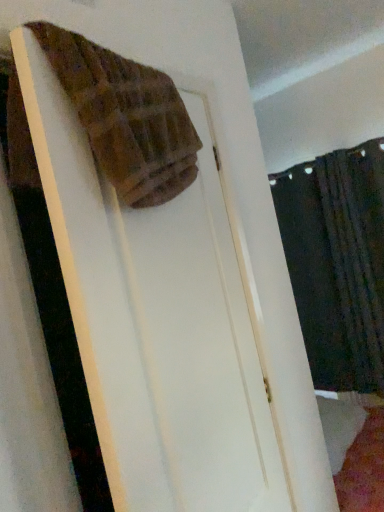
The height and width of the screenshot is (512, 384). Describe the element at coordinates (125, 117) in the screenshot. I see `brown woven towel at upper left` at that location.

Locate an element on the screen. Image resolution: width=384 pixels, height=512 pixels. brown woven towel at upper left is located at coordinates (125, 117).

The image size is (384, 512). What do you see at coordinates (337, 262) in the screenshot?
I see `dark fabric curtain at right` at bounding box center [337, 262].

I want to click on dark fabric curtain at right, so click(x=337, y=262).

You are a GUI agent. You are given a task and a screenshot of the screen. Output one action in this format:
    pyautogui.click(x=<x>, y=<y>)
    Task: Click on the brown woven towel at upper left
    The width and height of the screenshot is (384, 512).
    Given the screenshot: What is the action you would take?
    pyautogui.click(x=125, y=117)

Does dark fabric curtain at right appear on the left side of brown woven towel at upper left?

No.

Which object is further away from the camera taking this photo, dark fabric curtain at right or brown woven towel at upper left?

dark fabric curtain at right is behind.

Considering the points (381, 292) and (72, 59), which point is behind, point (381, 292) or point (72, 59)?

The point (381, 292) is farther from the camera.

From the image's perspective, is dark fabric curtain at right under brown woven towel at upper left?

Yes.

From a real-world perspective, is dark fabric curtain at right located higher than brown woven towel at upper left?

No, from a real-world perspective, dark fabric curtain at right is not over brown woven towel at upper left

Looking at their sizes, would you say dark fabric curtain at right is wider or thinner than brown woven towel at upper left?

dark fabric curtain at right is thinner than brown woven towel at upper left.

In the scene shown: Considering the sizes of objects dark fabric curtain at right and brown woven towel at upper left in the image provided, who is taller, dark fabric curtain at right or brown woven towel at upper left?

dark fabric curtain at right is taller.

Who is bigger, dark fabric curtain at right or brown woven towel at upper left?

Bigger between the two is dark fabric curtain at right.

Can brown woven towel at upper left be found inside dark fabric curtain at right?

No, brown woven towel at upper left is located outside of dark fabric curtain at right.

Are dark fabric curtain at right and brown woven towel at upper left far apart?

Absolutely, dark fabric curtain at right is distant from brown woven towel at upper left.

Could you tell me if dark fabric curtain at right is facing brown woven towel at upper left?

Yes, dark fabric curtain at right is aimed at brown woven towel at upper left.

What's the angular difference between dark fabric curtain at right and brown woven towel at upper left's facing directions?

There is a 99.9-degree angle between the facing directions of dark fabric curtain at right and brown woven towel at upper left.

The height and width of the screenshot is (512, 384). What are the coordinates of `curtain below the brown woven towel at upper left (from the image's perspective)` in the screenshot? It's located at [337, 262].

Is brown woven towel at upper left at the right side of dark fabric curtain at right?

In fact, brown woven towel at upper left is to the left of dark fabric curtain at right.

Which object is further away from the camera, brown woven towel at upper left or dark fabric curtain at right?

dark fabric curtain at right is more distant.

Is point (177, 174) closer or farther from the camera than point (331, 230)?

Clearly, point (177, 174) is closer to the camera than point (331, 230).

From the image's perspective, is brown woven towel at upper left located beneath dark fabric curtain at right?

No, from the image's perspective, brown woven towel at upper left is not below dark fabric curtain at right.

From a real-world perspective, is brown woven towel at upper left on top of dark fabric curtain at right?

Yes, from a real-world perspective, brown woven towel at upper left is over dark fabric curtain at right

Can you confirm if brown woven towel at upper left is wider than dark fabric curtain at right?

Yes, brown woven towel at upper left is wider than dark fabric curtain at right.

Is brown woven towel at upper left shorter than dark fabric curtain at right?

Indeed, brown woven towel at upper left has a lesser height compared to dark fabric curtain at right.

Considering the relative sizes of brown woven towel at upper left and dark fabric curtain at right in the image provided, is brown woven towel at upper left bigger than dark fabric curtain at right?

Incorrect, brown woven towel at upper left is not larger than dark fabric curtain at right.

Is brown woven towel at upper left outside of dark fabric curtain at right?

Yes, brown woven towel at upper left is not within dark fabric curtain at right.

Are brown woven towel at upper left and dark fabric curtain at right far apart?

Indeed, brown woven towel at upper left is not near dark fabric curtain at right.

Is brown woven towel at upper left looking in the opposite direction of dark fabric curtain at right?

No, brown woven towel at upper left is not facing away from dark fabric curtain at right.

From the picture: How different are the orientations of brown woven towel at upper left and dark fabric curtain at right in degrees?

The angular difference between brown woven towel at upper left and dark fabric curtain at right is 99.9 degrees.

Where is `towel above the dark fabric curtain at right (from the image's perspective)`? towel above the dark fabric curtain at right (from the image's perspective) is located at coordinates (125, 117).

At what (x,y) coordinates should I click in order to perform the action: click on towel on the left of dark fabric curtain at right. Please return your answer as a coordinate pair (x, y). The width and height of the screenshot is (384, 512). Looking at the image, I should click on (125, 117).

You are a GUI agent. You are given a task and a screenshot of the screen. Output one action in this format:
    pyautogui.click(x=<x>, y=<y>)
    Task: Click on the towel that appears in front of the dark fabric curtain at right
    The width and height of the screenshot is (384, 512).
    Given the screenshot: What is the action you would take?
    pyautogui.click(x=125, y=117)